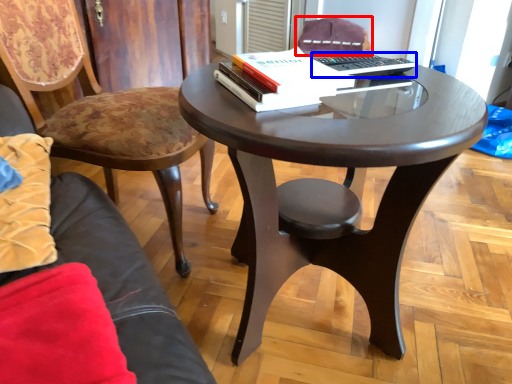
Question: Which object is closer to the camera taking this photo, chair (highlighted by a red box) or laptop keyboard (highlighted by a blue box)?

Choices:
 (A) chair
 (B) laptop keyboard

Answer: (B)